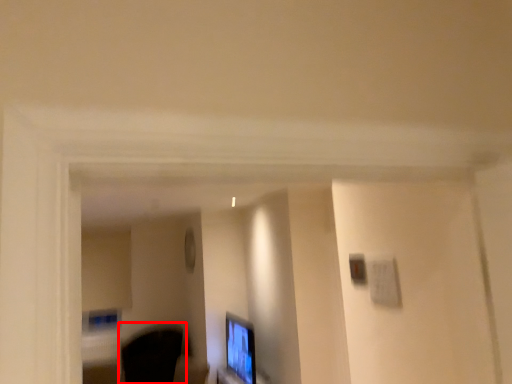
Question: Considering the relative positions of swivel chair (annotated by the red box) and computer monitor in the image provided, where is swivel chair (annotated by the red box) located with respect to the staircase?

Choices:
 (A) right
 (B) left

Answer: (B)